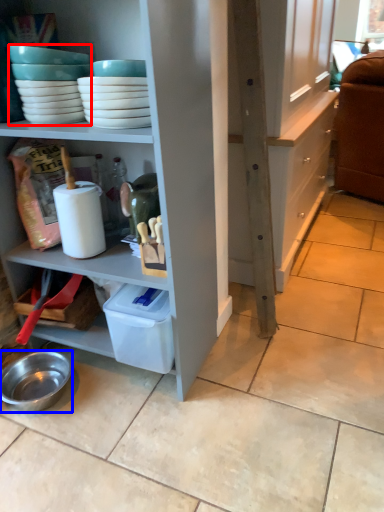
Question: Among these objects, which one is nearest to the camera, tableware (highlighted by a red box) or bowl (highlighted by a blue box)?

Choices:
 (A) tableware
 (B) bowl

Answer: (A)